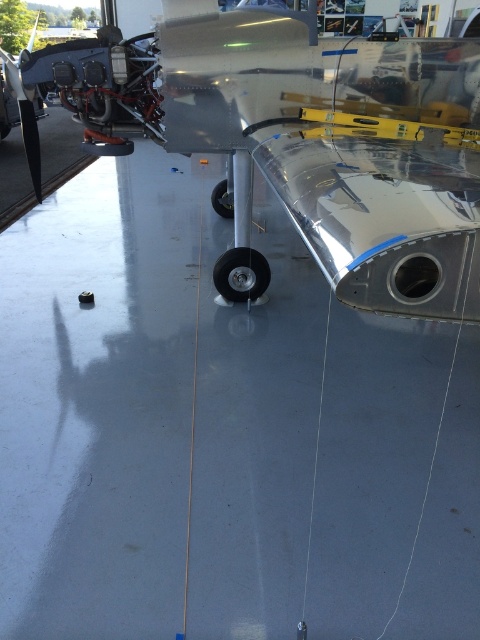
You are a maintenance technician in the hangar. You need to access both the metallic silver airplane at center and the brushed metal propeller at left. Which object will require you to move closer to reach it?

The brushed metal propeller at left is further away from you than the metallic silver airplane at center, so you will need to move closer to reach the brushed metal propeller at left.

You are an aircraft technician standing in the hangar. You need to determine which object between the metallic silver airplane at center and the brushed metal propeller at left is shorter. Can you identify the shorter one?

The metallic silver airplane at center is shorter than the brushed metal propeller at left.